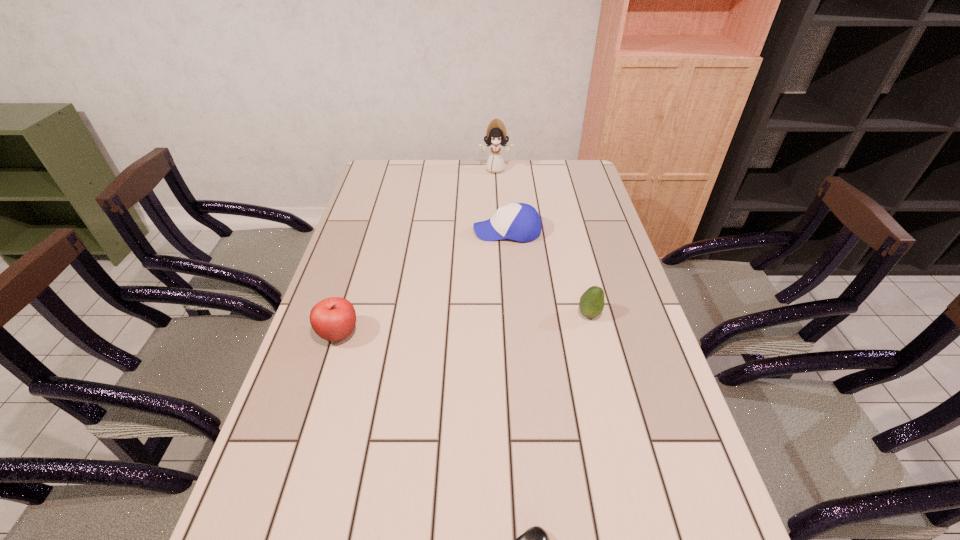
Find the location of a particular element. free spot located on the front-facing side of the fourth nearest object is located at coordinates (441, 231).

You are a GUI agent. You are given a task and a screenshot of the screen. Output one action in this format:
    pyautogui.click(x=<x>, y=<y>)
    Task: Click on the object at the far edge
    
    Given the screenshot: What is the action you would take?
    pyautogui.click(x=496, y=136)

Find the location of a particular element. object at the left edge is located at coordinates (333, 319).

Locate an element on the screen. The image size is (960, 540). object that is at the right edge is located at coordinates (592, 301).

Where is `vacant space at the far edge`? Image resolution: width=960 pixels, height=540 pixels. vacant space at the far edge is located at coordinates (433, 163).

The height and width of the screenshot is (540, 960). I want to click on free space at the left edge, so click(295, 434).

Where is `blank area at the right edge`? The image size is (960, 540). blank area at the right edge is located at coordinates point(659,437).

This screenshot has height=540, width=960. What are the coordinates of `vacant space at the far left corner` in the screenshot? It's located at (x=398, y=179).

What are the coordinates of `free space between the tallest object and the avocado` in the screenshot? It's located at (542, 242).

The image size is (960, 540). Find the location of `empty location between the farthest object and the apple`. empty location between the farthest object and the apple is located at coordinates (417, 252).